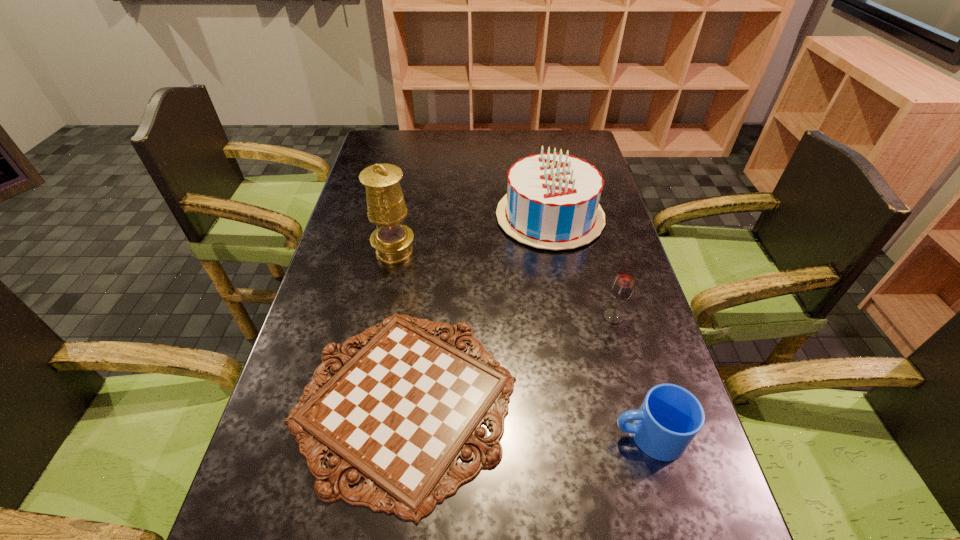
The width and height of the screenshot is (960, 540). What are the coordinates of `the tallest object` in the screenshot? It's located at (386, 207).

Find the location of a particular element. birthday cake is located at coordinates (552, 202).

This screenshot has height=540, width=960. I want to click on the third shortest object, so click(622, 287).

Identify the location of mug. (670, 417).

In order to click on the shortest object in this screenshot , I will do `click(399, 413)`.

Identify the location of free space located 0.070m on the front of the oil lamp. The height and width of the screenshot is (540, 960). (388, 284).

The height and width of the screenshot is (540, 960). Find the location of `vacant space located on the back of the birthday cake`. vacant space located on the back of the birthday cake is located at coordinates (535, 134).

The height and width of the screenshot is (540, 960). I want to click on vacant space located 0.090m on the left of the glass drink container, so click(x=566, y=317).

Locate an element on the screen. The width and height of the screenshot is (960, 540). free space located on the side of the mug with the handle is located at coordinates [x=463, y=436].

Identify the location of vacant space located 0.070m on the side of the mug with the handle. (577, 436).